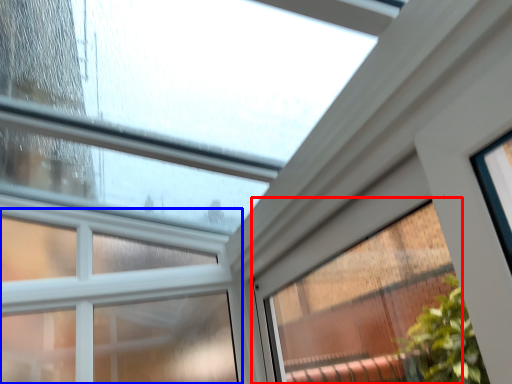
Question: Which object appears closest to the camera in this image, window (highlighted by a red box) or window (highlighted by a blue box)?

Choices:
 (A) window
 (B) window

Answer: (A)